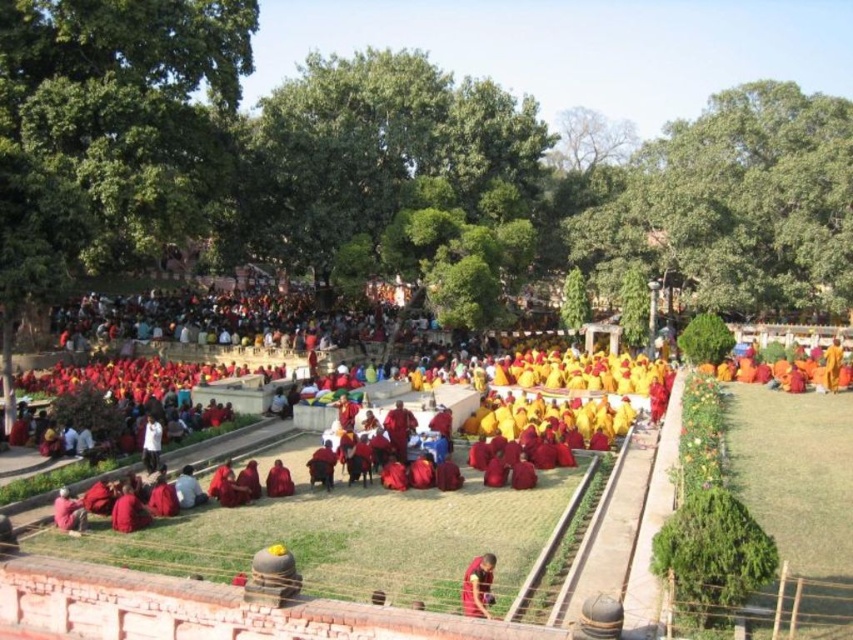
Can you confirm if red velvet robe at lower left is positioned to the left of red velvet robe at center?

Correct, you'll find red velvet robe at lower left to the left of red velvet robe at center.

From the picture: Which is more to the right, red velvet robe at lower left or red velvet robe at center?

red velvet robe at center is more to the right.

Does point (74, 513) come closer to viewer compared to point (292, 484)?

Yes, point (74, 513) is in front of point (292, 484).

What are the coordinates of `red velvet robe at lower left` in the screenshot? It's located at (68, 512).

Is point (105, 492) farther from camera compared to point (482, 568)?

Yes, it is.

Between red cotton robes at center and red velvet monk at center, which one is positioned lower?

red velvet monk at center is lower down.

The image size is (853, 640). Identify the location of red cotton robes at center. (564, 438).

Identify the location of red cotton robes at center. The height and width of the screenshot is (640, 853). (564, 438).

Is red cotton robes at center bigger than red velvet robe at lower left?

Yes, red cotton robes at center is bigger than red velvet robe at lower left.

Is red cotton robes at center further to the viewer compared to red velvet robe at lower left?

No, red cotton robes at center is in front of red velvet robe at lower left.

Who is more forward, (393,541) or (59,506)?

Point (393,541) is in front.

This screenshot has height=640, width=853. Find the location of `red cotton robes at center`. red cotton robes at center is located at coordinates (564, 438).